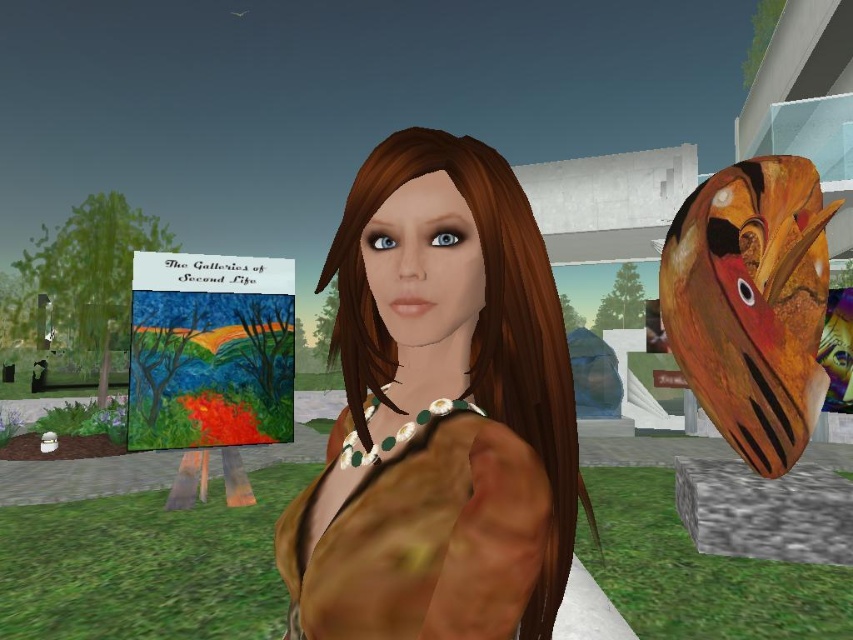
Question: Where is brown matte jacket at center located in relation to brown matte dress at center in the image?

Choices:
 (A) right
 (B) left

Answer: (A)

Question: Does brown matte jacket at center appear on the right side of brown matte dress at center?

Choices:
 (A) no
 (B) yes

Answer: (B)

Question: Which of the following is the closest to the observer?

Choices:
 (A) (386, 525)
 (B) (410, 284)

Answer: (A)

Question: Can you confirm if brown matte jacket at center is positioned below brown matte dress at center?

Choices:
 (A) yes
 (B) no

Answer: (B)

Question: Which of the following is the farthest from the observer?

Choices:
 (A) (461, 579)
 (B) (572, 476)

Answer: (B)